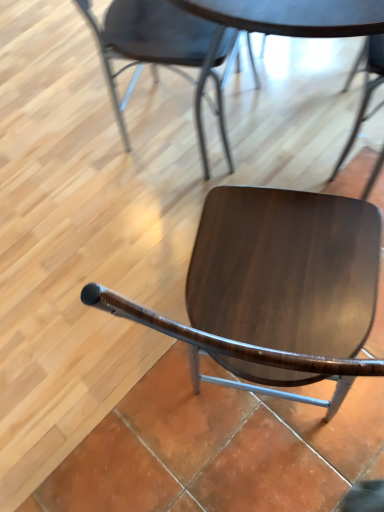
The width and height of the screenshot is (384, 512). I want to click on vacant space positioned to the left of matte black chair at upper center, so click(87, 152).